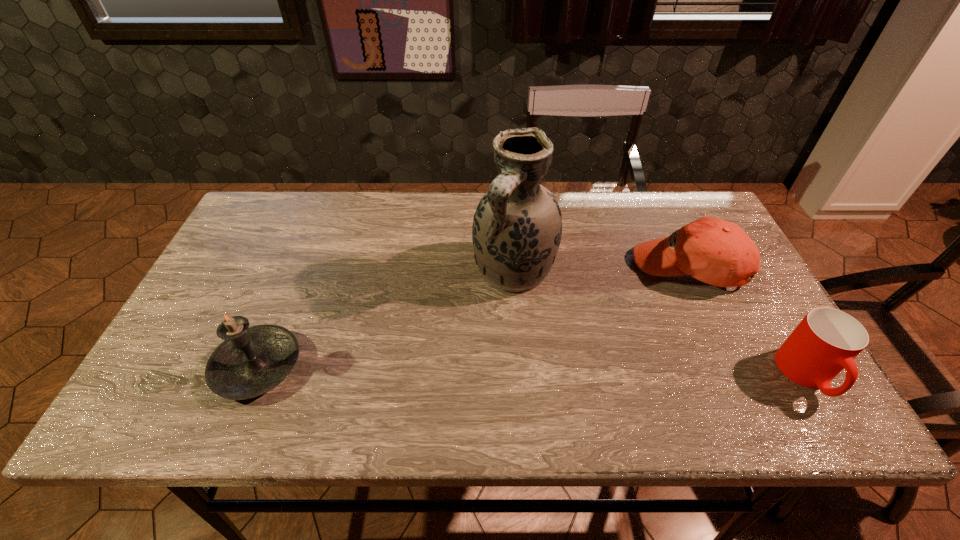
Identify the location of the second tallest object. (251, 361).

Where is `candle`? The height and width of the screenshot is (540, 960). candle is located at coordinates (251, 361).

Find the location of a particular element. Image resolution: width=960 pixels, height=540 pixels. cup is located at coordinates (826, 341).

Find the location of a particular element. This screenshot has height=540, width=960. the tallest object is located at coordinates (517, 227).

This screenshot has height=540, width=960. In order to click on the third object from right to left in this screenshot , I will do `click(517, 227)`.

At what (x,y) coordinates should I click in order to perform the action: click on baseball cap. Please return your answer as a coordinate pair (x, y). Looking at the image, I should click on (717, 252).

Where is `free spot located 0.050m on the right of the candle`? free spot located 0.050m on the right of the candle is located at coordinates (323, 367).

Identify the location of vacant space positioned with the handle on the side of the vase. The height and width of the screenshot is (540, 960). (468, 350).

Where is `free location located with the handle on the side of the vase`? The width and height of the screenshot is (960, 540). free location located with the handle on the side of the vase is located at coordinates (457, 370).

The image size is (960, 540). What are the coordinates of `free location located 0.180m with the handle on the side of the vase` in the screenshot? It's located at 467,354.